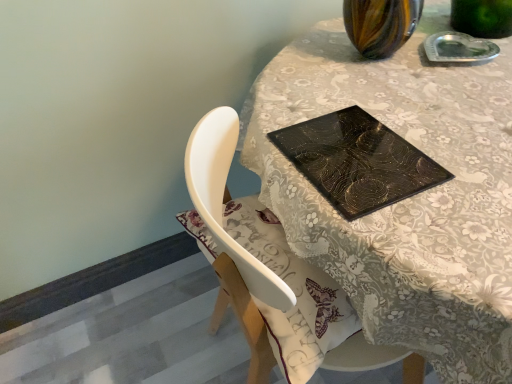
Question: Is matte black glass table at center located outside black glossy placemat at upper center?

Choices:
 (A) no
 (B) yes

Answer: (B)

Question: Does matte black glass table at center have a greater height compared to black glossy placemat at upper center?

Choices:
 (A) no
 (B) yes

Answer: (B)

Question: From a real-world perspective, is matte black glass table at center over black glossy placemat at upper center?

Choices:
 (A) yes
 (B) no

Answer: (B)

Question: Is the depth of matte black glass table at center greater than that of black glossy placemat at upper center?

Choices:
 (A) yes
 (B) no

Answer: (B)

Question: From the image's perspective, would you say matte black glass table at center is shown under black glossy placemat at upper center?

Choices:
 (A) no
 (B) yes

Answer: (B)

Question: Considering the relative positions of matte black glass table at center and black glossy placemat at upper center in the image provided, is matte black glass table at center to the right of black glossy placemat at upper center from the viewer's perspective?

Choices:
 (A) yes
 (B) no

Answer: (A)

Question: From a real-world perspective, is black glossy placemat at upper center on matte black glass table at center?

Choices:
 (A) no
 (B) yes

Answer: (B)

Question: Is black glossy placemat at upper center next to matte black glass table at center and touching it?

Choices:
 (A) yes
 (B) no

Answer: (B)

Question: Considering the relative sizes of black glossy placemat at upper center and matte black glass table at center in the image provided, is black glossy placemat at upper center taller than matte black glass table at center?

Choices:
 (A) yes
 (B) no

Answer: (B)

Question: Is black glossy placemat at upper center shorter than matte black glass table at center?

Choices:
 (A) no
 (B) yes

Answer: (B)

Question: Is black glossy placemat at upper center far away from matte black glass table at center?

Choices:
 (A) no
 (B) yes

Answer: (A)

Question: Is black glossy placemat at upper center positioned in front of matte black glass table at center?

Choices:
 (A) yes
 (B) no

Answer: (B)

Question: In terms of height, does black glossy placemat at upper center look taller or shorter compared to matte black glass table at center?

Choices:
 (A) short
 (B) tall

Answer: (A)